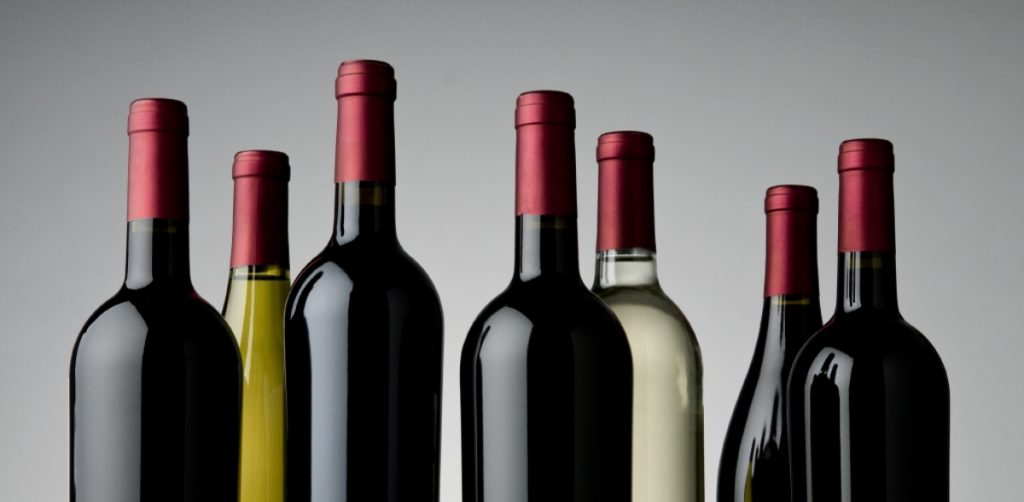
Find the location of a particular element. This screenshot has width=1024, height=502. wine bottles is located at coordinates (825, 401), (753, 425), (648, 423), (581, 423), (393, 380), (261, 378), (194, 391).